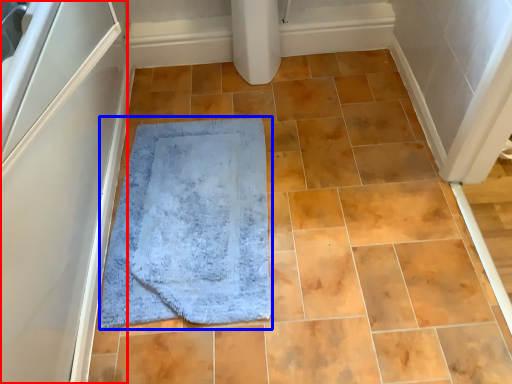
Question: Which of the following is the farthest to the observer, screen door (highlighted by a red box) or bath mat (highlighted by a blue box)?

Choices:
 (A) screen door
 (B) bath mat

Answer: (B)